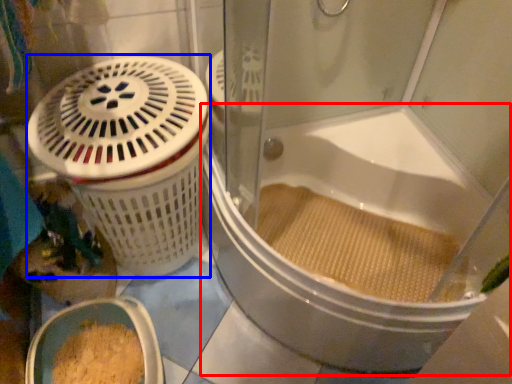
Question: Among these objects, which one is farthest to the camera, bathtub (highlighted by a red box) or basket container (highlighted by a blue box)?

Choices:
 (A) bathtub
 (B) basket container

Answer: (B)